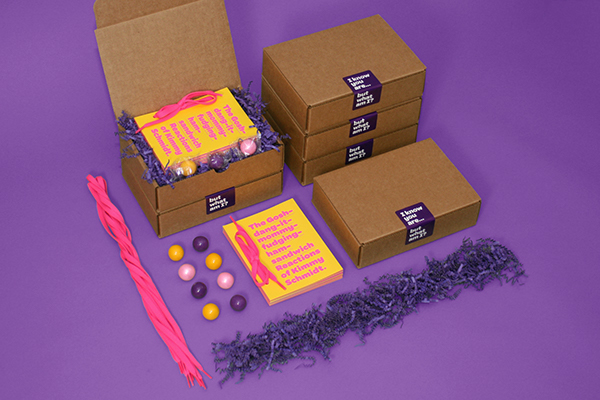
Locate an element on the screen. The width and height of the screenshot is (600, 400). book is located at coordinates (285, 246).